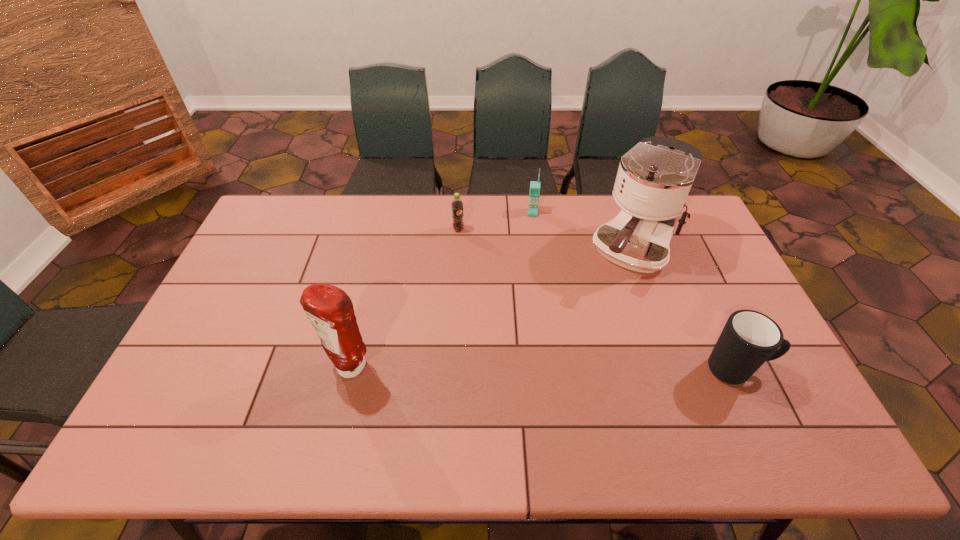
You are a GUI agent. You are given a task and a screenshot of the screen. Output one action in this format:
    pyautogui.click(x=<x>, y=<y>)
    Task: Click on the vacant position located 0.160m on the front-facing side of the coffee maker
    Image resolution: width=960 pixels, height=540 pixels.
    Given the screenshot: What is the action you would take?
    pyautogui.click(x=595, y=318)

I want to click on vacant space located 0.310m on the front-facing side of the coffee maker, so click(x=572, y=354).

At what (x,y) coordinates should I click in order to perform the action: click on vacant space located on the front label of the shortest object. Please return your answer as a coordinate pair (x, y). The height and width of the screenshot is (540, 960). Looking at the image, I should click on (498, 280).

Find the location of a particular element. The image size is (960, 540). blank space located 0.270m on the front label of the shortest object is located at coordinates (499, 282).

Identify the location of vacant position located 0.210m on the front label of the shortest object. (491, 271).

Where is `vacant space located on the keypad of the cellular telephone`? vacant space located on the keypad of the cellular telephone is located at coordinates (529, 273).

Find the location of a particular element. The width and height of the screenshot is (960, 540). free space located 0.050m on the keypad of the cellular telephone is located at coordinates (532, 226).

The width and height of the screenshot is (960, 540). I want to click on vacant area situated 0.090m on the keypad of the cellular telephone, so click(532, 233).

This screenshot has width=960, height=540. What are the coordinates of `coffee maker that is at the far edge` in the screenshot? It's located at (654, 178).

At what (x,y) coordinates should I click in order to perform the action: click on soda located in the far edge section of the desktop. Please return your answer as a coordinate pair (x, y). Image resolution: width=960 pixels, height=540 pixels. Looking at the image, I should click on (457, 205).